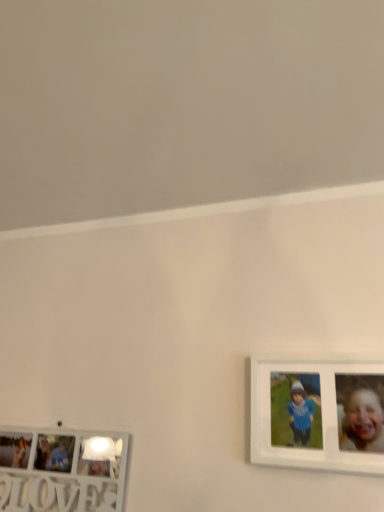
Question: Is white matte picture frame at right, which ranks as the 1th picture frame in top-to-bottom order, positioned with its back to white wooden picture frame at lower left, which is the first picture frame in left-to-right order?

Choices:
 (A) yes
 (B) no

Answer: (B)

Question: Considering the relative positions of white matte picture frame at right, which appears as the 2th picture frame when viewed from the left, and white wooden picture frame at lower left, acting as the second picture frame starting from the right, in the image provided, is white matte picture frame at right, which appears as the 2th picture frame when viewed from the left, to the right of white wooden picture frame at lower left, acting as the second picture frame starting from the right, from the viewer's perspective?

Choices:
 (A) no
 (B) yes

Answer: (B)

Question: From the image's perspective, is white matte picture frame at right, the 1th picture frame viewed from the right, beneath white wooden picture frame at lower left, which is the 1th picture frame from bottom to top?

Choices:
 (A) no
 (B) yes

Answer: (A)

Question: Is white wooden picture frame at lower left, which is the first picture frame in left-to-right order, inside white matte picture frame at right, which appears as the 2th picture frame when viewed from the left?

Choices:
 (A) yes
 (B) no

Answer: (B)

Question: Is white matte picture frame at right, which appears as the 2th picture frame when viewed from the left, smaller than white wooden picture frame at lower left, which is the first picture frame in left-to-right order?

Choices:
 (A) no
 (B) yes

Answer: (B)

Question: Is there a large distance between white matte picture frame at right, positioned as the 2th picture frame in bottom-to-top order, and white wooden picture frame at lower left, which is the 1th picture frame from bottom to top?

Choices:
 (A) no
 (B) yes

Answer: (A)

Question: From the image's perspective, is white wooden picture frame at lower left, which is the 2th picture frame from top to bottom, beneath white matte picture frame at right, positioned as the 2th picture frame in bottom-to-top order?

Choices:
 (A) yes
 (B) no

Answer: (A)

Question: Is white wooden picture frame at lower left, acting as the second picture frame starting from the right, not within white matte picture frame at right, which appears as the 2th picture frame when viewed from the left?

Choices:
 (A) yes
 (B) no

Answer: (A)

Question: Is white wooden picture frame at lower left, which is the 2th picture frame from top to bottom, bigger than white matte picture frame at right, the 1th picture frame viewed from the right?

Choices:
 (A) no
 (B) yes

Answer: (B)

Question: Is white wooden picture frame at lower left, which is the 2th picture frame from top to bottom, next to white matte picture frame at right, the 1th picture frame viewed from the right?

Choices:
 (A) yes
 (B) no

Answer: (B)

Question: Is the depth of white wooden picture frame at lower left, which is the first picture frame in left-to-right order, greater than that of white matte picture frame at right, the 1th picture frame viewed from the right?

Choices:
 (A) yes
 (B) no

Answer: (A)

Question: Is white wooden picture frame at lower left, which is the 1th picture frame from bottom to top, shorter than white matte picture frame at right, which appears as the 2th picture frame when viewed from the left?

Choices:
 (A) yes
 (B) no

Answer: (A)

Question: Is white matte picture frame at right, positioned as the 2th picture frame in bottom-to-top order, in front of or behind white wooden picture frame at lower left, which is the first picture frame in left-to-right order, in the image?

Choices:
 (A) front
 (B) behind

Answer: (A)